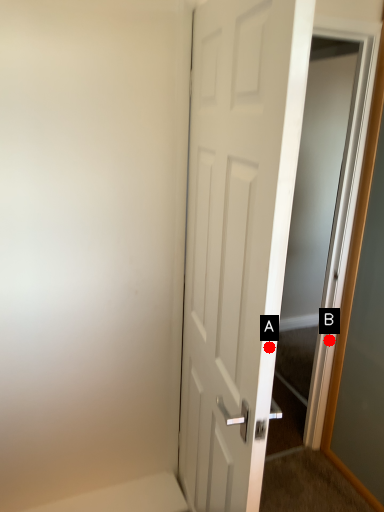
Question: Two points are circled on the image, labeled by A and B beside each circle. Which point is closer to the camera taking this photo?

Choices:
 (A) A is closer
 (B) B is closer

Answer: (A)